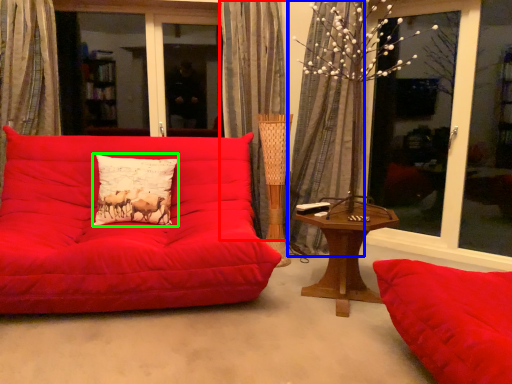
Question: Based on their relative distances, which object is nearer to curtain (highlighted by a red box)? Choose from curtain (highlighted by a blue box) and pillow (highlighted by a green box).

Choices:
 (A) curtain
 (B) pillow

Answer: (A)